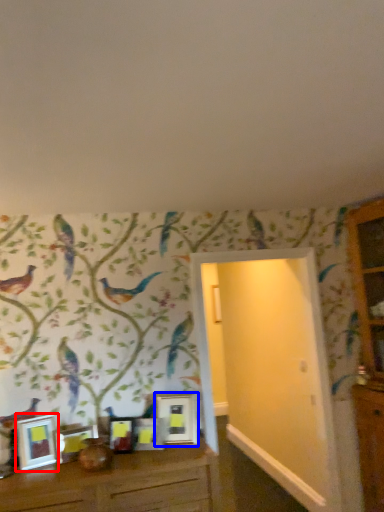
Question: Which of the following is the farthest to the observer, picture frame (highlighted by a red box) or picture frame (highlighted by a blue box)?

Choices:
 (A) picture frame
 (B) picture frame

Answer: (B)